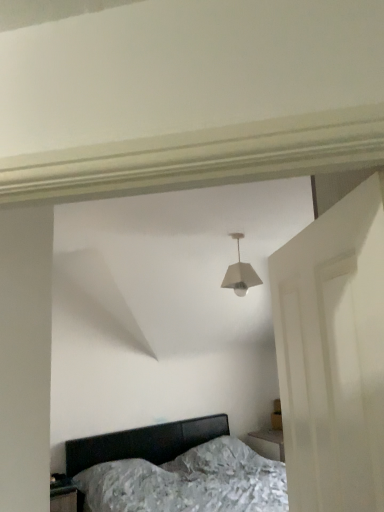
What is the approximate height of white matte door at right?

white matte door at right is 34.12 inches in height.

Locate an element on the screen. white matte door at right is located at coordinates (333, 355).

Where is `matte black bed at lower center`? The width and height of the screenshot is (384, 512). matte black bed at lower center is located at coordinates (174, 470).

Between white matte lampshade at center and white matte door at right, which one appears on the right side from the viewer's perspective?

white matte door at right.

Is point (229, 234) positioned after point (302, 352)?

Yes, it is.

From the image's perspective, is white matte lampshade at center beneath white matte door at right?

No, from the image's perspective, white matte lampshade at center is not beneath white matte door at right.

Does white matte lampshade at center contain white matte door at right?

No, white matte door at right is located outside of white matte lampshade at center.

Is matte black bed at lower center in front of or behind white matte door at right in the image?

Visually, matte black bed at lower center is located behind white matte door at right.

Can you confirm if matte black bed at lower center is taller than white matte door at right?

Indeed, matte black bed at lower center has a greater height compared to white matte door at right.

Is matte black bed at lower center at the left side of white matte door at right?

Yes.

Which of these two, matte black bed at lower center or white matte door at right, is wider?

matte black bed at lower center is wider.

Is white matte door at right not close to white matte lampshade at center?

Yes, white matte door at right is far from white matte lampshade at center.

From a real-world perspective, is white matte door at right positioned over white matte lampshade at center based on gravity?

Incorrect, from a real-world perspective, white matte door at right is lower than white matte lampshade at center.

How different are the orientations of white matte door at right and white matte lampshade at center in degrees?

They differ by 120 degrees in their facing directions.

Which is more to the left, white matte door at right or white matte lampshade at center?

white matte lampshade at center is more to the left.

Are white matte lampshade at center and matte black bed at lower center located far from each other?

white matte lampshade at center is far away from matte black bed at lower center.

Is white matte lampshade at center shorter than matte black bed at lower center?

Yes.

Does white matte lampshade at center have a larger size compared to matte black bed at lower center?

Incorrect, white matte lampshade at center is not larger than matte black bed at lower center.

In the image, is white matte lampshade at center on the left side or the right side of matte black bed at lower center?

white matte lampshade at center is to the right of matte black bed at lower center.

From a real-world perspective, is matte black bed at lower center beneath white matte lampshade at center?

Yes.

Which is behind, point (127, 486) or point (247, 274)?

The point (127, 486) is more distant.

Does matte black bed at lower center have a greater height compared to white matte lampshade at center?

Correct, matte black bed at lower center is much taller as white matte lampshade at center.

Is matte black bed at lower center to the right of white matte lampshade at center from the viewer's perspective?

No.

From a real-world perspective, is white matte door at right positioned above or below matte black bed at lower center?

In terms of real-world spatial position, white matte door at right is above matte black bed at lower center.

How many degrees apart are the facing directions of white matte door at right and matte black bed at lower center?

121 degrees.

Could you tell me if white matte door at right is facing matte black bed at lower center?

No, white matte door at right is not oriented towards matte black bed at lower center.

From the image's perspective, who appears lower, white matte door at right or matte black bed at lower center?

From the image's view, matte black bed at lower center is below.

Locate an element on the screen. Image resolution: width=384 pixels, height=512 pixels. door below the white matte lampshade at center (from a real-world perspective) is located at coordinates pos(333,355).

At what (x,y) coordinates should I click in order to perform the action: click on bed that is on the left side of white matte door at right. Please return your answer as a coordinate pair (x, y). Looking at the image, I should click on (174, 470).

Based on their spatial positions, is white matte door at right or matte black bed at lower center closer to white matte lampshade at center?

white matte door at right lies closer to white matte lampshade at center than the other object.

When comparing their distances from white matte door at right, does matte black bed at lower center or white matte lampshade at center seem further?

Among the two, matte black bed at lower center is located further to white matte door at right.

Looking at the image, which one is located closer to matte black bed at lower center, white matte lampshade at center or white matte door at right?

Among the two, white matte lampshade at center is located nearer to matte black bed at lower center.

Looking at the image, which one is located further to matte black bed at lower center, white matte door at right or white matte lampshade at center?

white matte door at right is further to matte black bed at lower center.

Estimate the real-world distances between objects in this image. Which object is further from white matte door at right, white matte lampshade at center or matte black bed at lower center?

The object further to white matte door at right is matte black bed at lower center.

Estimate the real-world distances between objects in this image. Which object is further from white matte lampshade at center, matte black bed at lower center or white matte door at right?

matte black bed at lower center is further to white matte lampshade at center.

This screenshot has width=384, height=512. What are the coordinates of `bed between white matte door at right and white matte lampshade at center along the z-axis` in the screenshot? It's located at (174, 470).